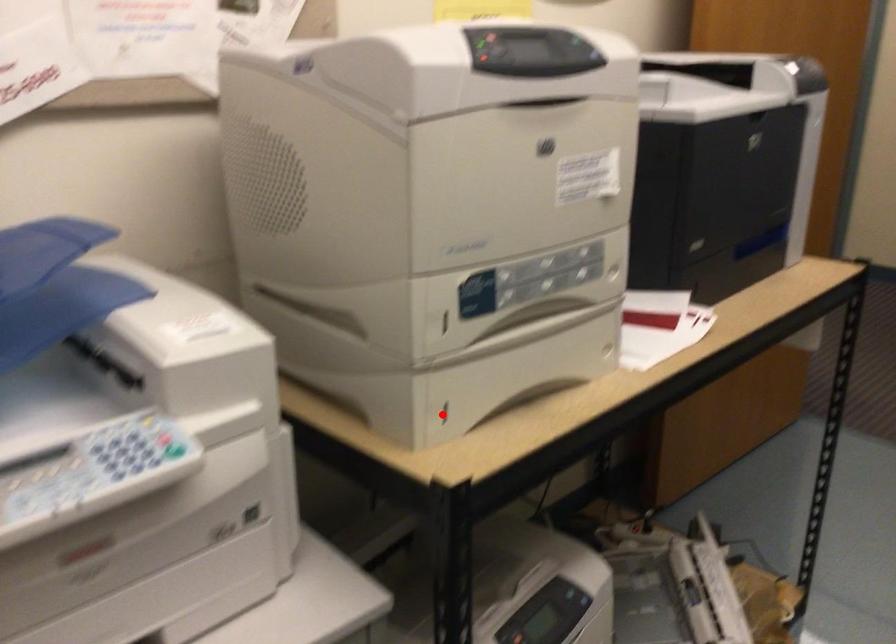
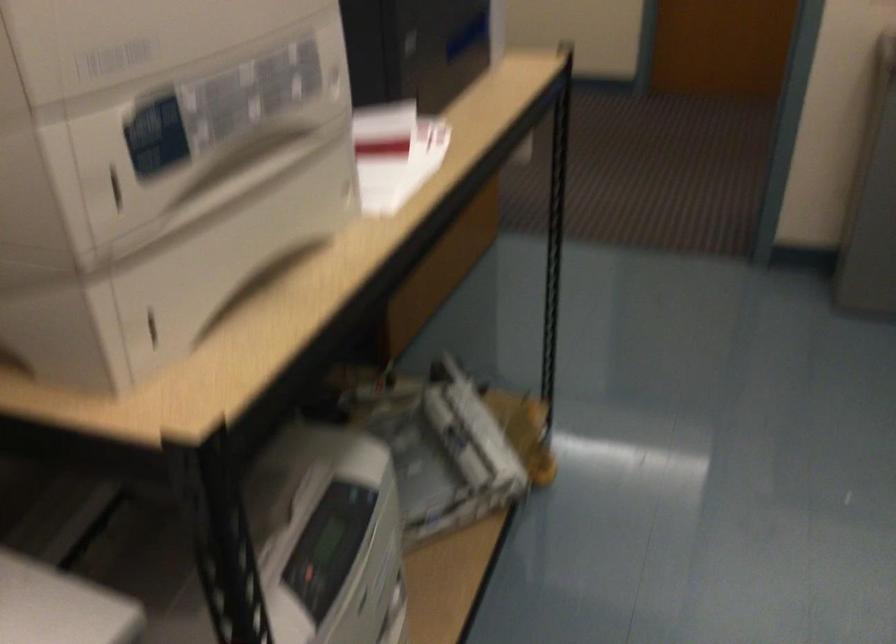
The point at the highlighted location is marked in the first image. Where is the corresponding point in the second image?

(151, 327)